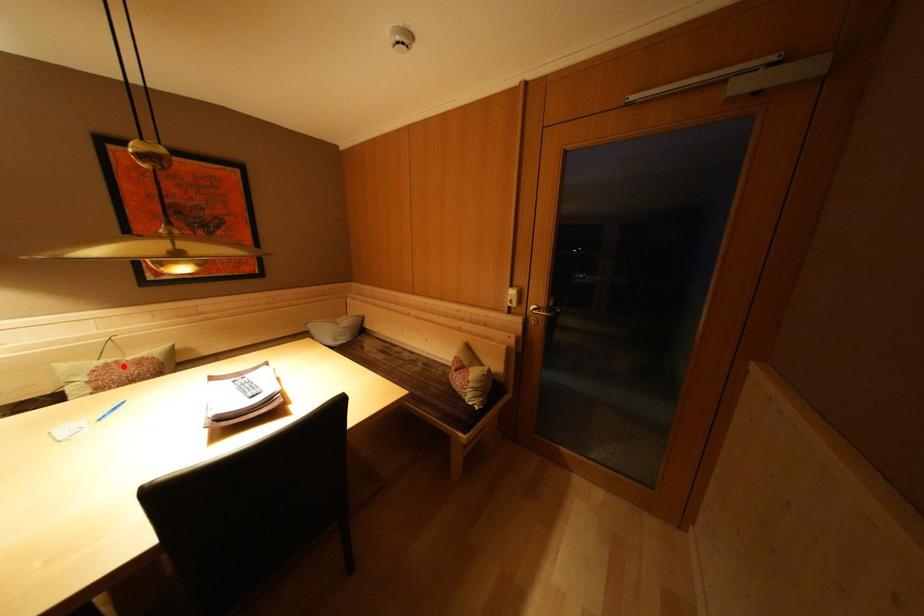
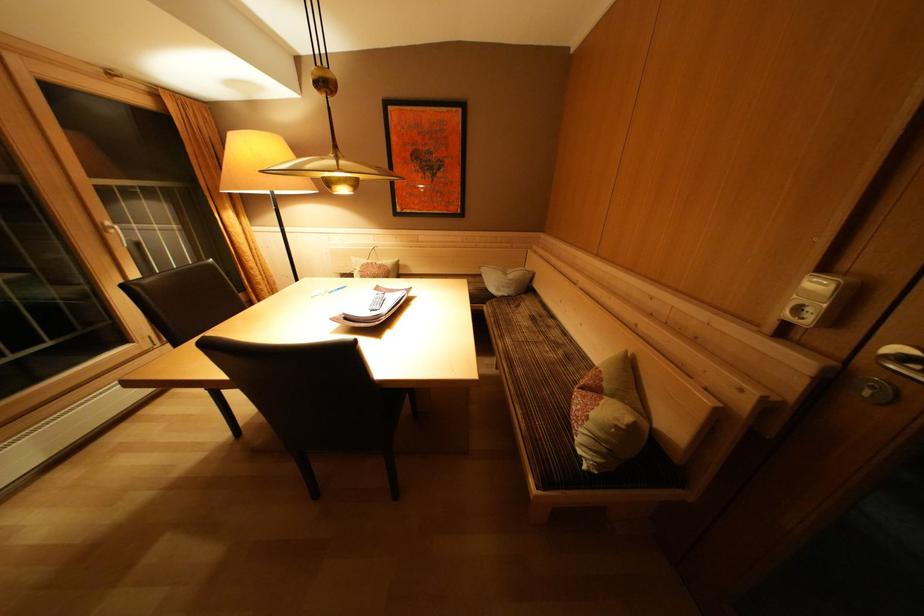
Question: I am providing you with two images of the same scene from different viewpoints. Image1 has a red point marked. In image2, the corresponding 3D location appears at what relative position? Reply with the corresponding letter.

Choices:
 (A) Closer
 (B) Farther

Answer: (A)